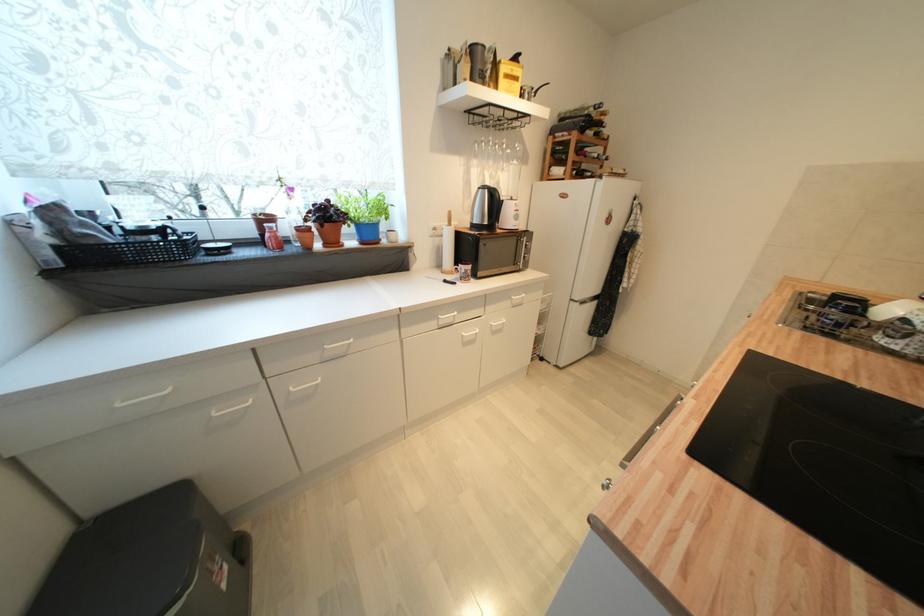
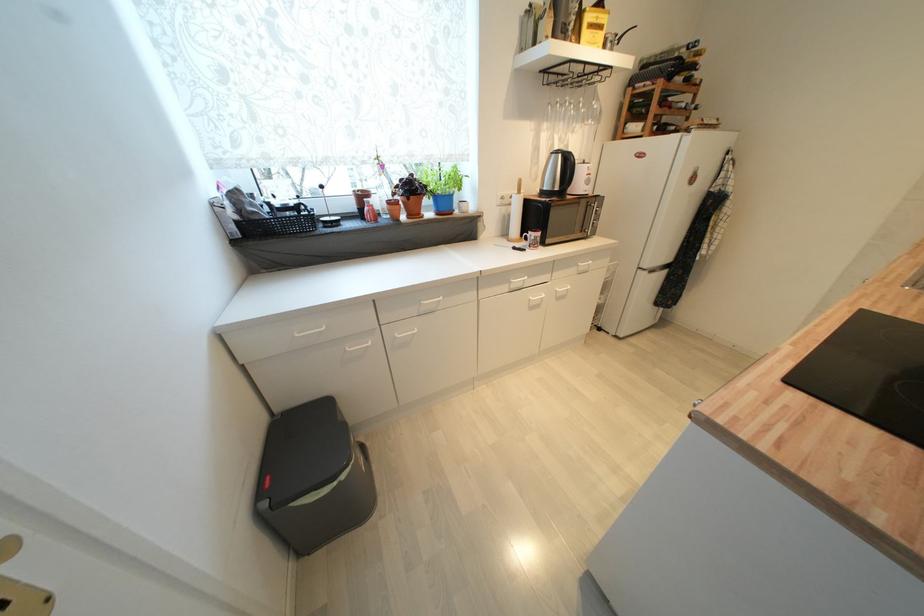
In the second image, find the point that corresponds to the point at 495,164 in the first image.

(566, 127)